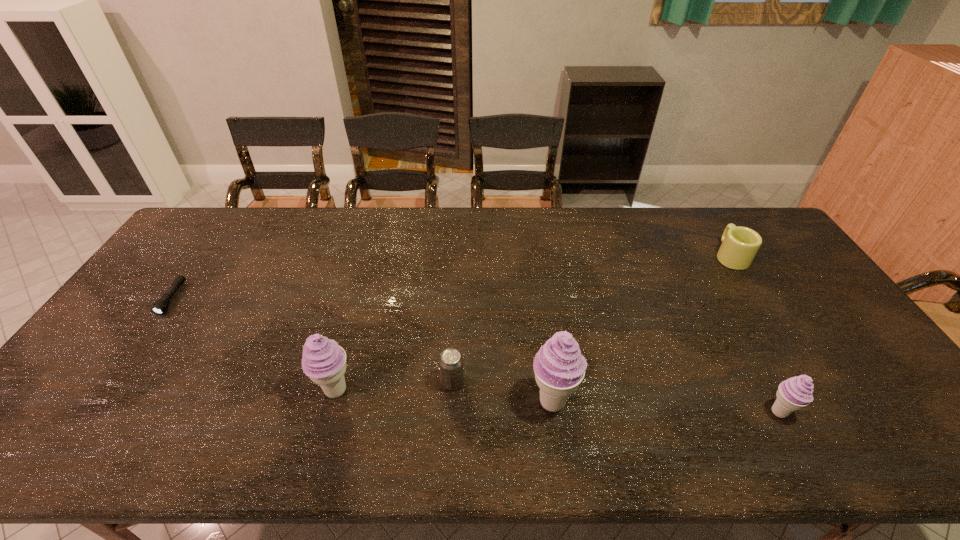
Identify the location of vacant point located between the third object from left to right and the rightmost object. (591, 319).

Identify the location of vacant area that lies between the beer can and the rightmost object. (591, 319).

Where is `free area in between the fourth shortest object and the fourth object from left to right`? The width and height of the screenshot is (960, 540). free area in between the fourth shortest object and the fourth object from left to right is located at coordinates (666, 407).

The width and height of the screenshot is (960, 540). I want to click on free space that is in between the beer can and the fourth object from left to right, so click(503, 392).

Find the location of `free space between the shortest icecream and the beer can`. free space between the shortest icecream and the beer can is located at coordinates (615, 397).

Locate an element on the screen. The image size is (960, 540). empty space between the fifth object from left to right and the second farthest object is located at coordinates (475, 355).

The width and height of the screenshot is (960, 540). I want to click on unoccupied area between the beer can and the second shortest icecream, so [x=395, y=386].

Identify which object is the second closest to the rightmost object. Please provide its 2D coordinates. Your answer should be formatted as a tuple, i.e. [(x, y)], where the tuple contains the x and y coordinates of a point satisfying the conditions above.

[(559, 367)]

Where is `object identified as the closest to the shortest object`? The width and height of the screenshot is (960, 540). object identified as the closest to the shortest object is located at coordinates (323, 360).

This screenshot has width=960, height=540. Find the location of `icecream identified as the second closest to the mug`. icecream identified as the second closest to the mug is located at coordinates (559, 367).